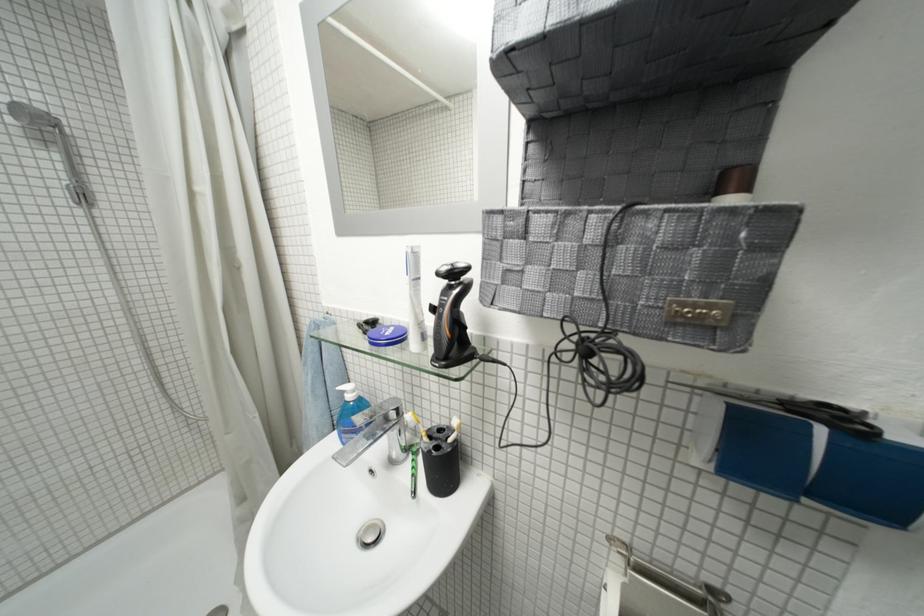
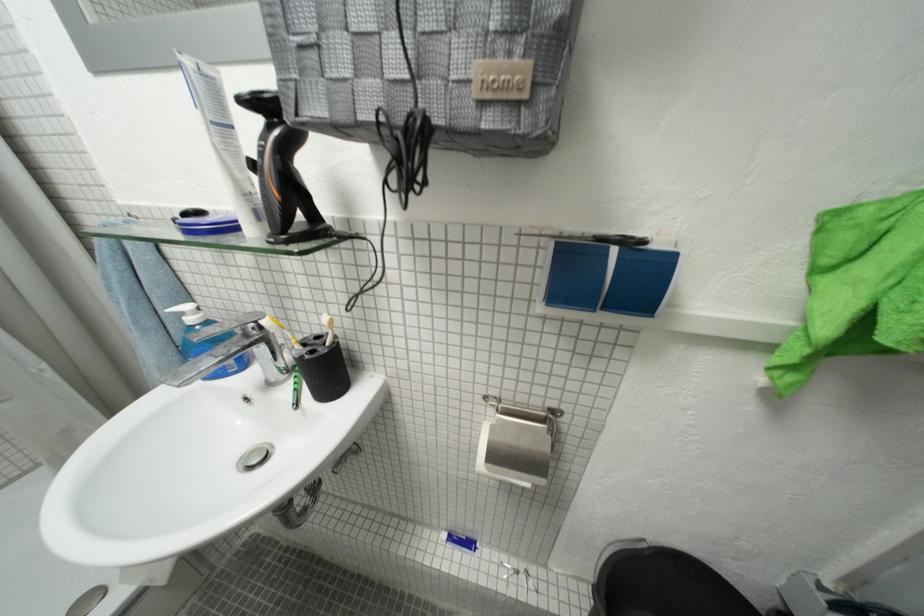
Where in the second image is the point corresponding to [450,438] from the first image?

(325, 342)